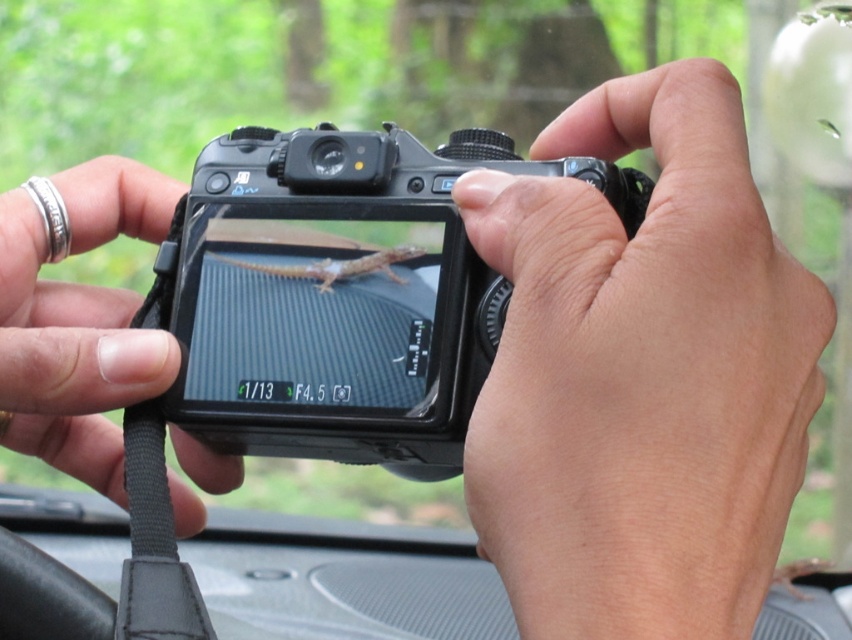
Is black matte camera at center below black leather strap at center?

Incorrect, black matte camera at center is not positioned below black leather strap at center.

Can you confirm if black matte camera at center is shorter than black leather strap at center?

Yes.

What do you see at coordinates (340, 294) in the screenshot? The image size is (852, 640). I see `black matte camera at center` at bounding box center [340, 294].

Image resolution: width=852 pixels, height=640 pixels. Identify the location of black matte camera at center. (340, 294).

Does point (616, 310) come behind point (170, 515)?

No, it is not.

Is smooth skin hand at center bigger than black leather strap at center?

Yes, smooth skin hand at center is bigger than black leather strap at center.

Is point (649, 593) closer to camera compared to point (160, 620)?

Yes, point (649, 593) is in front of point (160, 620).

Locate an element on the screen. smooth skin hand at center is located at coordinates (642, 374).

Can you confirm if black matte camera at center is wider than silver metallic ring at upper left?

Correct, the width of black matte camera at center exceeds that of silver metallic ring at upper left.

Consider the image. Who is more distant from viewer, (268,440) or (85,378)?

Point (268,440)

Locate an element on the screen. The image size is (852, 640). black matte camera at center is located at coordinates (340, 294).